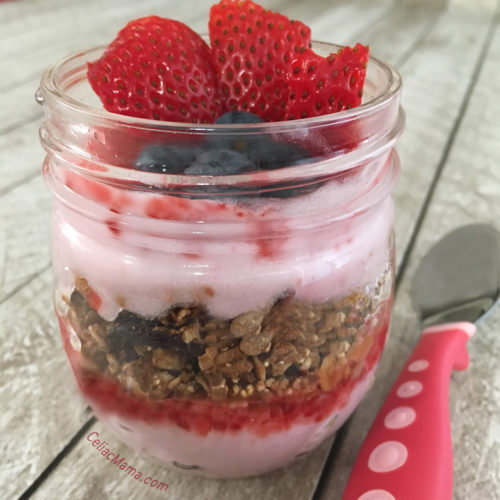
You are a GUI agent. You are given a task and a screenshot of the screen. Output one action in this format:
    pyautogui.click(x=<x>, y=<y>)
    Task: Click on the spoon
    Image resolution: width=500 pixels, height=500 pixels.
    Given the screenshot: What is the action you would take?
    pyautogui.click(x=434, y=370)